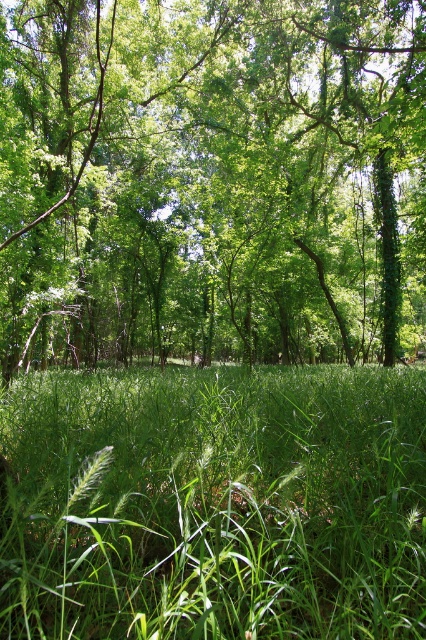
You are a hiker trying to navigate through the forest. You see the green leafy tree at center and the green grassy at center. Which one would you choose to walk around to avoid getting wet?

The green leafy tree at center has a larger size compared to green grassy at center, so you should walk around the green leafy tree at center to avoid getting wet.

You are a hiker trying to see the view beyond the green leafy tree at center. Since you are standing at the green grassy at center, can you move forward to get a better view?

The green grassy at center is behind the green leafy tree at center, so you cannot move forward to get a better view because you are already behind the tree.